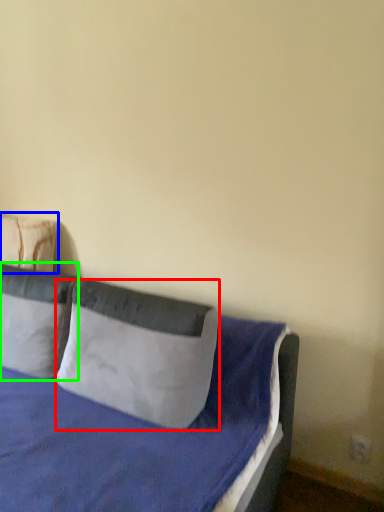
Question: Which object is the closest to the pillow (highlighted by a red box)? Choose among these: pillow (highlighted by a blue box) or pillow (highlighted by a green box).

Choices:
 (A) pillow
 (B) pillow

Answer: (B)